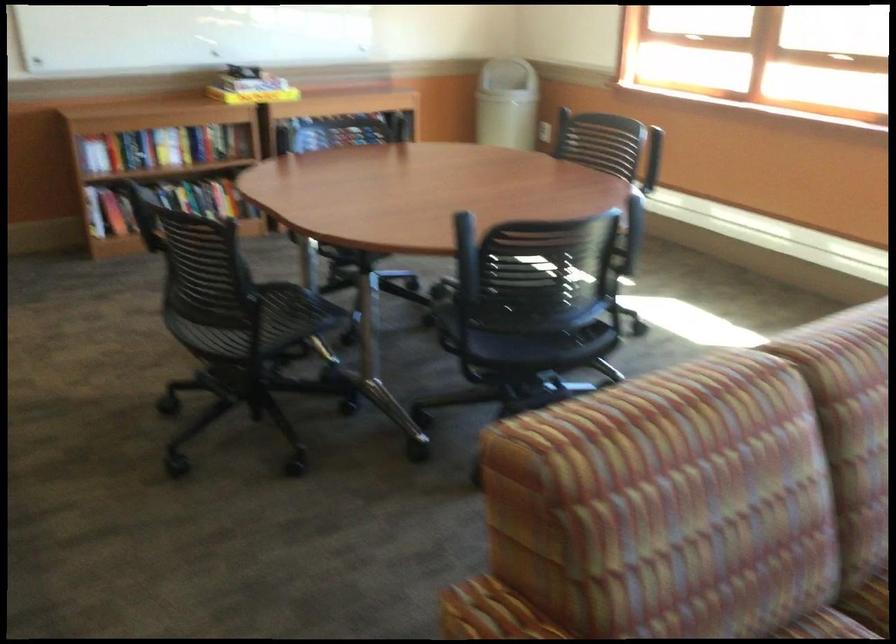
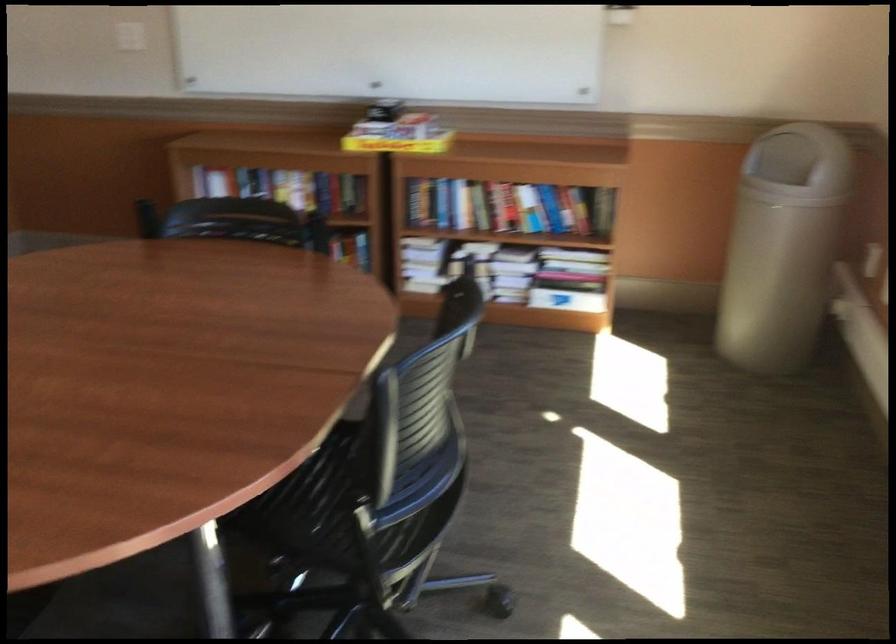
Find the pixel in the second image that matches point 229,91 in the first image.

(398, 144)